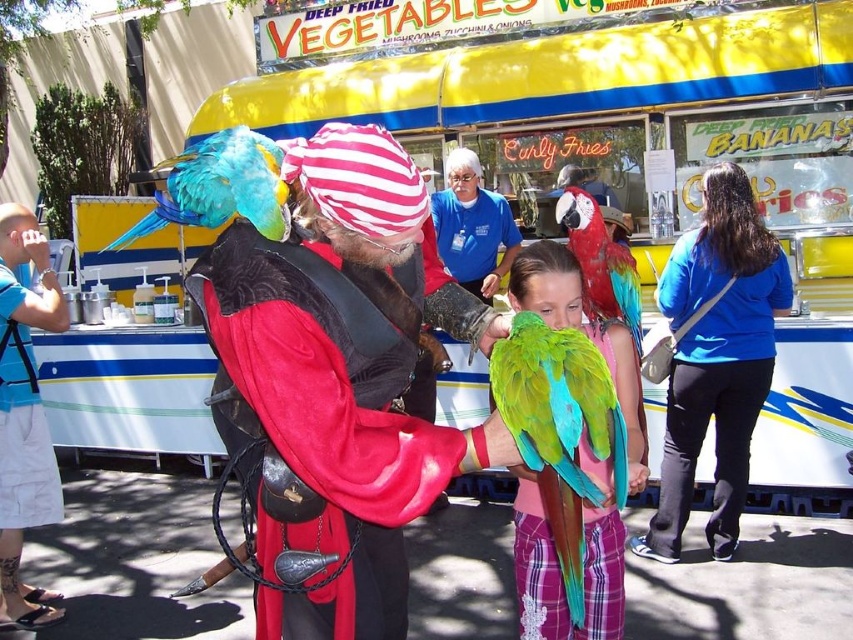
Question: Does velvet pirate costume at center appear on the left side of blue-green feathers parrot at center?

Choices:
 (A) no
 (B) yes

Answer: (A)

Question: Based on their relative distances, which object is nearer to the shiny red parrot at center?

Choices:
 (A) blue shirt at center
 (B) velvet pirate costume at center
 (C) green matte parrot at center
 (D) blue-green feathers parrot at center

Answer: (C)

Question: Which point appears closest to the camera in this image?

Choices:
 (A) (614, 291)
 (B) (244, 156)

Answer: (B)

Question: Among these objects, which one is farthest from the camera?

Choices:
 (A) blue-green feathers parrot at center
 (B) blue fabric shirt at center
 (C) yellow fabric food truck at center
 (D) blue shirt at center

Answer: (C)

Question: Does brushed metal camera at left appear on the right side of shiny red parrot at center?

Choices:
 (A) yes
 (B) no

Answer: (B)

Question: Is velvet pirate costume at center behind blue shirt at center?

Choices:
 (A) no
 (B) yes

Answer: (A)